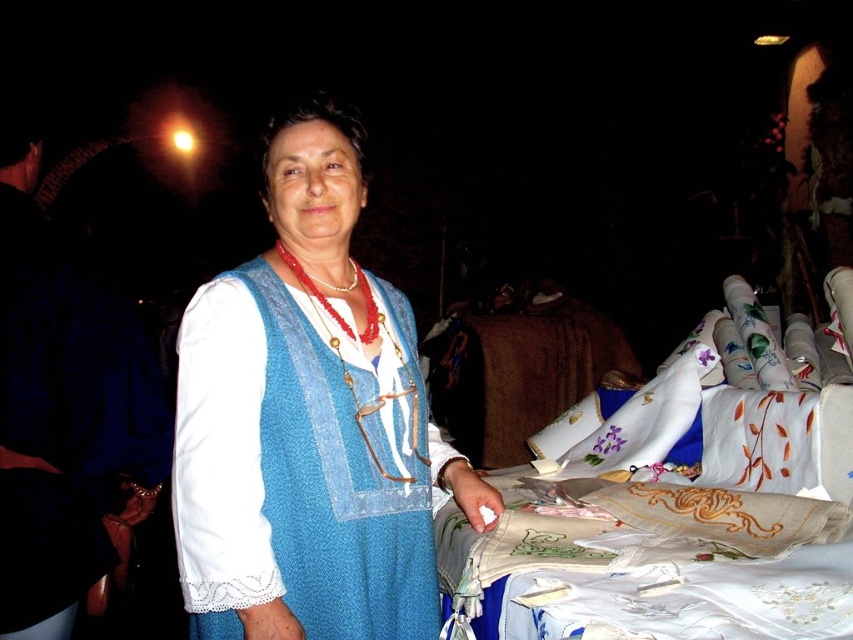
In order to click on blue knitted vest at center in this screenshot , I will do `click(308, 422)`.

The width and height of the screenshot is (853, 640). In order to click on blue knitted vest at center in this screenshot , I will do `click(308, 422)`.